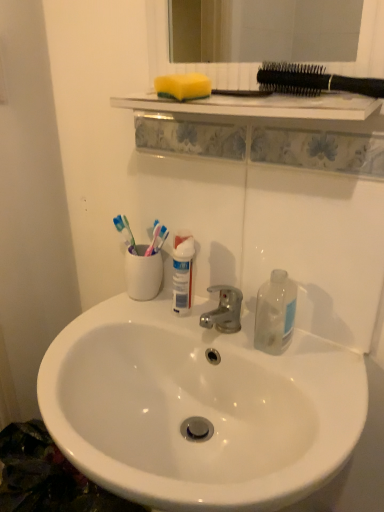
Question: Is white ceramic toothbrush holder at center outside of black plastic toothbrushes at upper right?

Choices:
 (A) no
 (B) yes

Answer: (B)

Question: From a real-world perspective, is white ceramic toothbrush holder at center over black plastic toothbrushes at upper right?

Choices:
 (A) yes
 (B) no

Answer: (B)

Question: Is white ceramic toothbrush holder at center positioned with its back to black plastic toothbrushes at upper right?

Choices:
 (A) no
 (B) yes

Answer: (A)

Question: Is white ceramic toothbrush holder at center touching black plastic toothbrushes at upper right?

Choices:
 (A) yes
 (B) no

Answer: (B)

Question: From the image's perspective, does white ceramic toothbrush holder at center appear lower than black plastic toothbrushes at upper right?

Choices:
 (A) yes
 (B) no

Answer: (A)

Question: Could you tell me if white ceramic toothbrush holder at center is turned towards black plastic toothbrushes at upper right?

Choices:
 (A) no
 (B) yes

Answer: (A)

Question: Is transparent plastic bottle at right facing towards yellow sponge at upper center?

Choices:
 (A) no
 (B) yes

Answer: (A)

Question: Is transparent plastic bottle at right bigger than yellow sponge at upper center?

Choices:
 (A) yes
 (B) no

Answer: (A)

Question: Considering the relative sizes of transparent plastic bottle at right and yellow sponge at upper center in the image provided, is transparent plastic bottle at right wider than yellow sponge at upper center?

Choices:
 (A) yes
 (B) no

Answer: (A)

Question: Does transparent plastic bottle at right have a lesser height compared to yellow sponge at upper center?

Choices:
 (A) yes
 (B) no

Answer: (B)

Question: Considering the relative sizes of transparent plastic bottle at right and yellow sponge at upper center in the image provided, is transparent plastic bottle at right smaller than yellow sponge at upper center?

Choices:
 (A) no
 (B) yes

Answer: (A)

Question: Is transparent plastic bottle at right in contact with yellow sponge at upper center?

Choices:
 (A) no
 (B) yes

Answer: (A)

Question: Can you confirm if yellow sponge at upper center is bigger than white ceramic toothbrush holder at center?

Choices:
 (A) no
 (B) yes

Answer: (A)